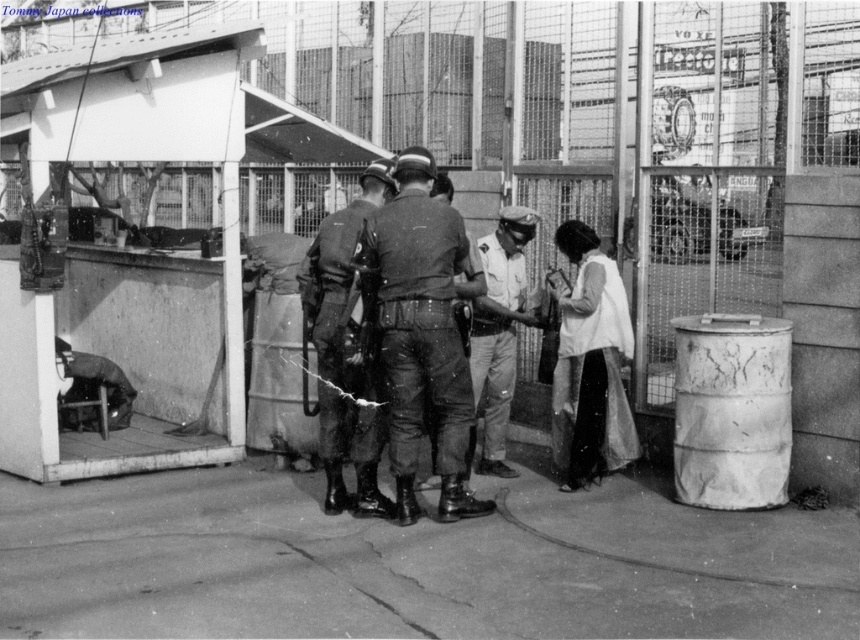
Question: Is dark green fabric uniform at center behind white matte uniform at center?

Choices:
 (A) no
 (B) yes

Answer: (A)

Question: Can you confirm if uniformed man at center is positioned to the right of white matte uniform at center?

Choices:
 (A) yes
 (B) no

Answer: (B)

Question: Which point is farther to the camera?

Choices:
 (A) uniformed man at center
 (B) white matte uniform at center

Answer: (B)

Question: Which of the following is the farthest from the observer?

Choices:
 (A) (480, 304)
 (B) (352, 220)

Answer: (A)

Question: Which object is the farthest from the dark green fabric uniform at center?

Choices:
 (A) white matte dress at lower right
 (B) uniformed man at center
 (C) white matte uniform at center

Answer: (A)

Question: From the image, what is the correct spatial relationship of dark green fabric uniform at center in relation to uniformed man at center?

Choices:
 (A) right
 (B) left

Answer: (A)